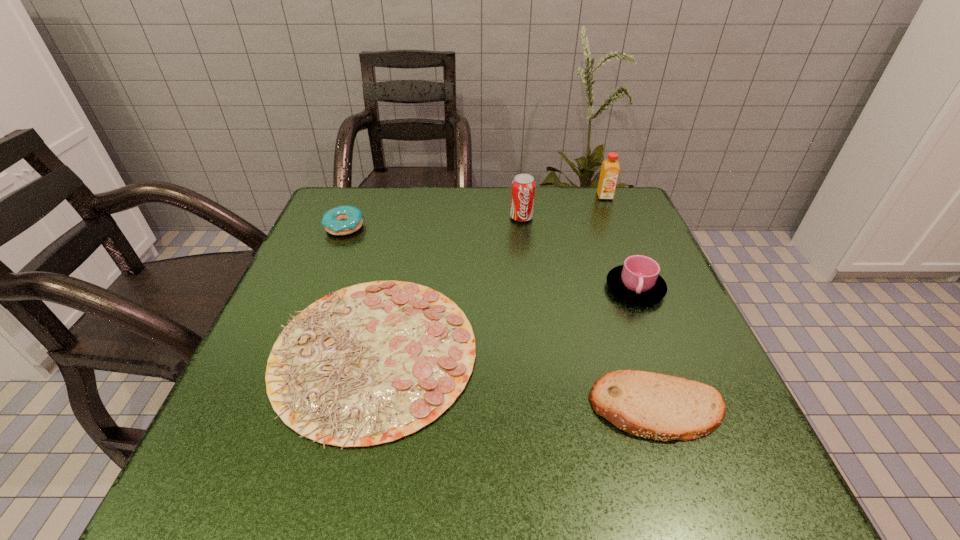
Where is `the farthest object`? The image size is (960, 540). the farthest object is located at coordinates (610, 168).

Image resolution: width=960 pixels, height=540 pixels. Identify the location of soda can. (523, 186).

Find the location of a particular element. The height and width of the screenshot is (540, 960). cup is located at coordinates (638, 280).

Identify the location of pizza. (368, 364).

Where is `doughnut`? doughnut is located at coordinates (343, 220).

Find the location of a particular element. This screenshot has height=540, width=960. pita bread is located at coordinates (656, 406).

You are a GUI agent. You are given a task and a screenshot of the screen. Output one action in this format:
    pyautogui.click(x=<x>, y=<y>)
    Task: Click on the vacant space located 0.060m on the front and back of the farthest object
    
    Given the screenshot: What is the action you would take?
    pyautogui.click(x=612, y=213)

In order to click on vacant space located 0.370m on the logo side of the fourth object from right to left in this screenshot , I will do `click(537, 338)`.

Identify the location of free space located on the side with the handle of the cup. Image resolution: width=960 pixels, height=540 pixels. click(680, 401).

Locate an element on the screen. The width and height of the screenshot is (960, 540). free location located 0.200m on the right of the pizza is located at coordinates (588, 354).